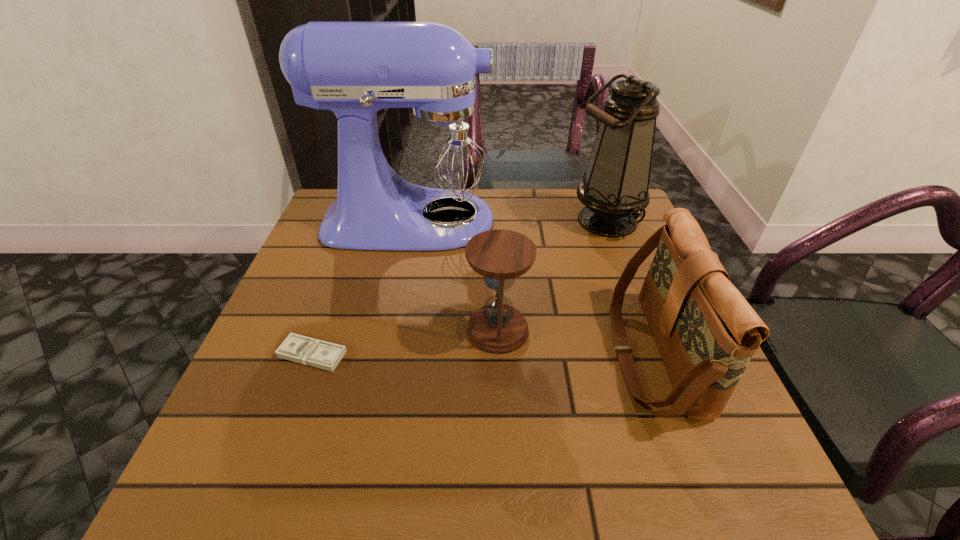
Find the location of a particular element. The image size is (960, 540). free space that satisfies the following two spatial constraints: 1. on the back side of the hourglass; 2. at the mixing area of the tallest object is located at coordinates click(493, 221).

At what (x,y) coordinates should I click in order to perform the action: click on free region that satisfies the following two spatial constraints: 1. at the mixing area of the mixer; 2. on the back side of the hourglass. Please return your answer as a coordinate pair (x, y). This screenshot has height=540, width=960. Looking at the image, I should click on (395, 330).